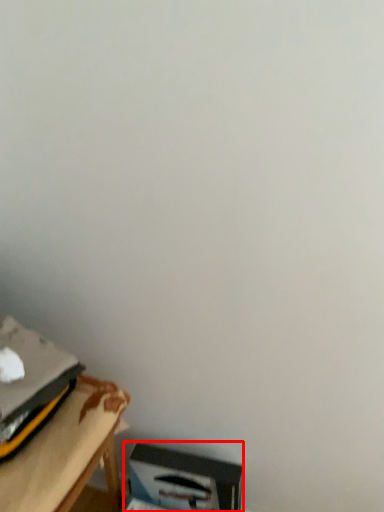
Question: From the image's perspective, where is cardboard box (annotated by the red box) located relative to table?

Choices:
 (A) below
 (B) above

Answer: (A)